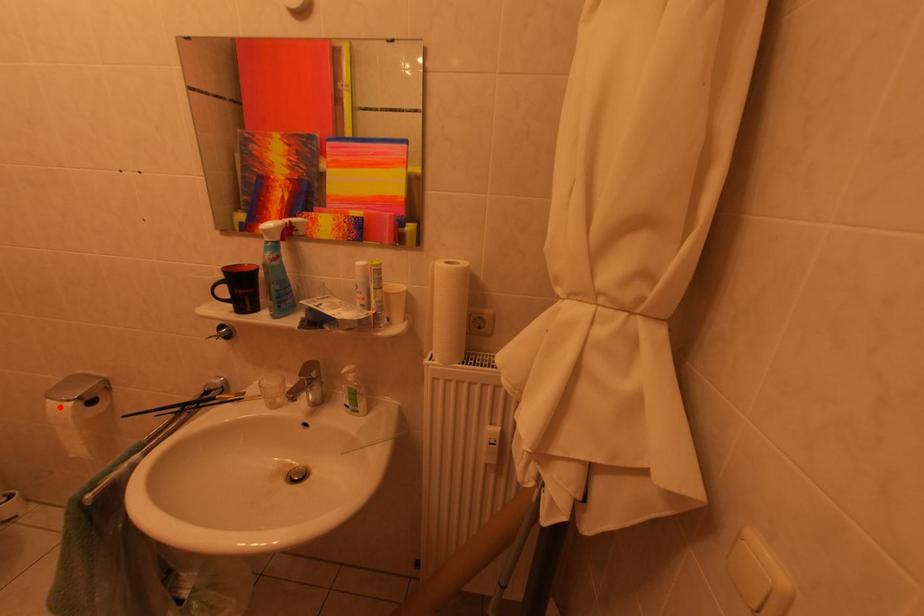
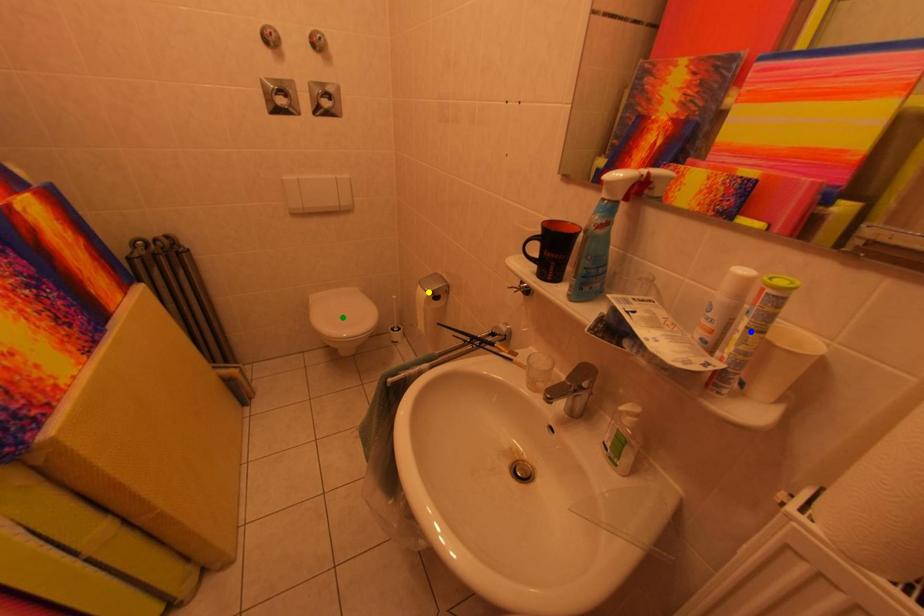
Question: I am providing you with two images of the same scene from different viewpoints. A red point is marked on the first image. You are given multiple points on the second image. Which mark in image 2 goes with the point in image 1?

Choices:
 (A) yellow point
 (B) blue point
 (C) green point

Answer: (A)